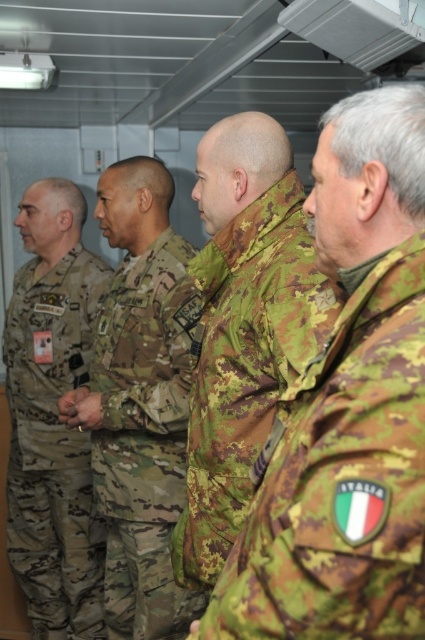
Question: Is camouflage uniform at center closer to the viewer compared to camouflage uniform at left?

Choices:
 (A) yes
 (B) no

Answer: (A)

Question: Can you confirm if camouflage fabric jacket at center is wider than camouflage uniform at left?

Choices:
 (A) yes
 (B) no

Answer: (B)

Question: Among these points, which one is nearest to the camera?

Choices:
 (A) (190, 570)
 (B) (155, 541)
 (C) (87, 312)

Answer: (A)

Question: Which is nearer to the camouflage uniform at center?

Choices:
 (A) camouflage fabric jacket at center
 (B) camouflage uniform at left

Answer: (A)

Question: Does camouflage uniform at center have a larger size compared to camouflage uniform at left?

Choices:
 (A) yes
 (B) no

Answer: (B)

Question: Among these objects, which one is nearest to the camera?

Choices:
 (A) camouflage uniform at center
 (B) camouflage fabric jacket at center

Answer: (B)